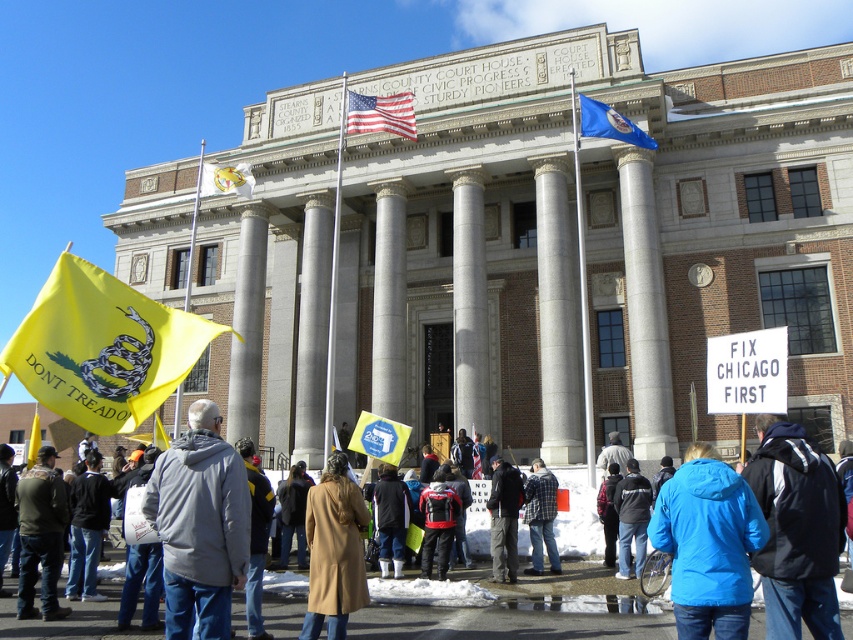
Question: Which of the following is the farthest from the observer?

Choices:
 (A) (228, 593)
 (B) (471, 611)

Answer: (B)

Question: Among these points, which one is nearest to the camera?

Choices:
 (A) (624, 506)
 (B) (408, 93)
 (C) (41, 538)
 (D) (692, 518)

Answer: (D)

Question: Is blue synthetic jacket at center closer to the viewer compared to dark gray jacket at lower left?

Choices:
 (A) no
 (B) yes

Answer: (B)

Question: Is american flag at center above white fabric flag at center?

Choices:
 (A) no
 (B) yes

Answer: (B)

Question: Is blue fabric jacket at lower center above flannel shirt at center?

Choices:
 (A) no
 (B) yes

Answer: (B)

Question: Among these objects, which one is farthest from the camera?

Choices:
 (A) dark gray jacket at center
 (B) american flag at center

Answer: (B)